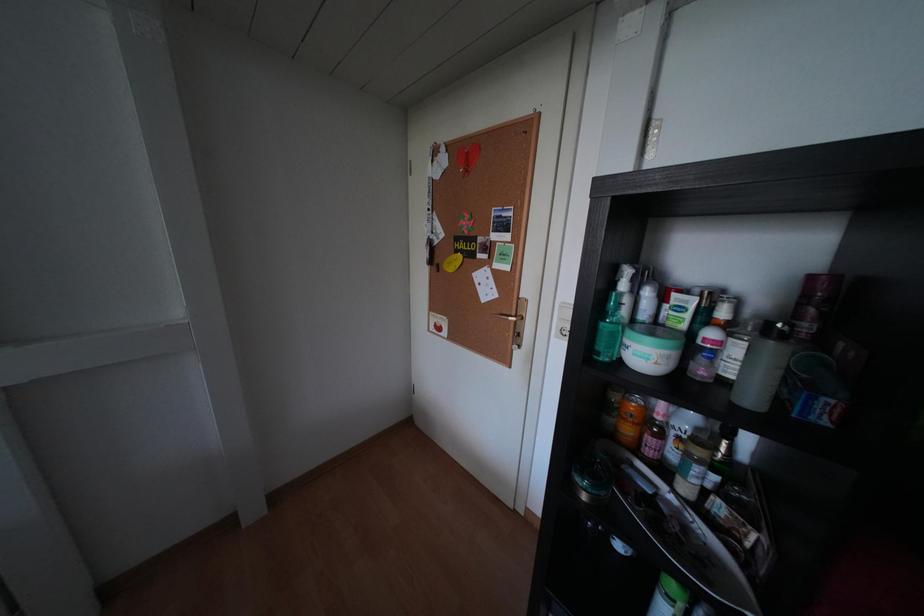
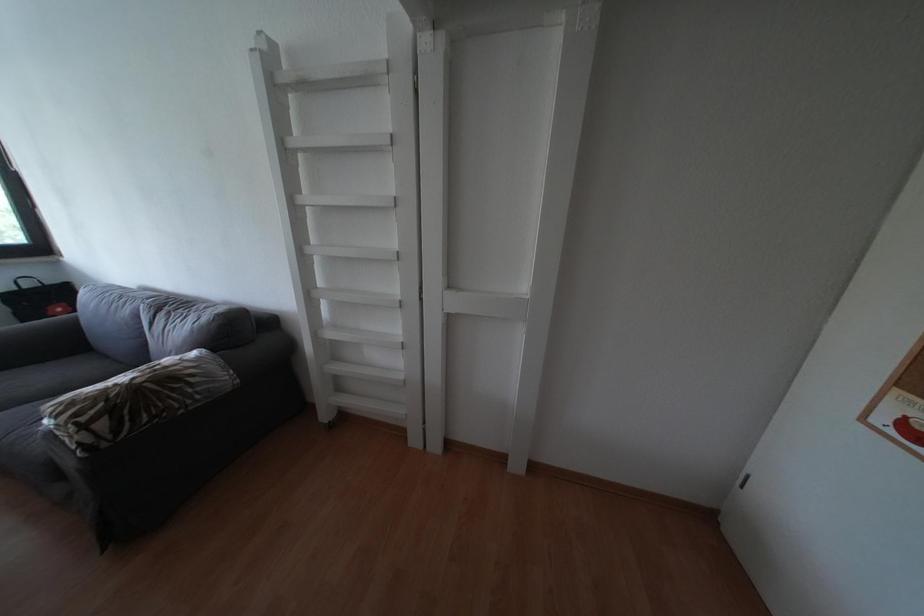
Question: The first image is from the beginning of the video and the second image is from the end. How did the camera likely rotate when shooting the video?

Choices:
 (A) Left
 (B) Right
 (C) Up
 (D) Down

Answer: (A)